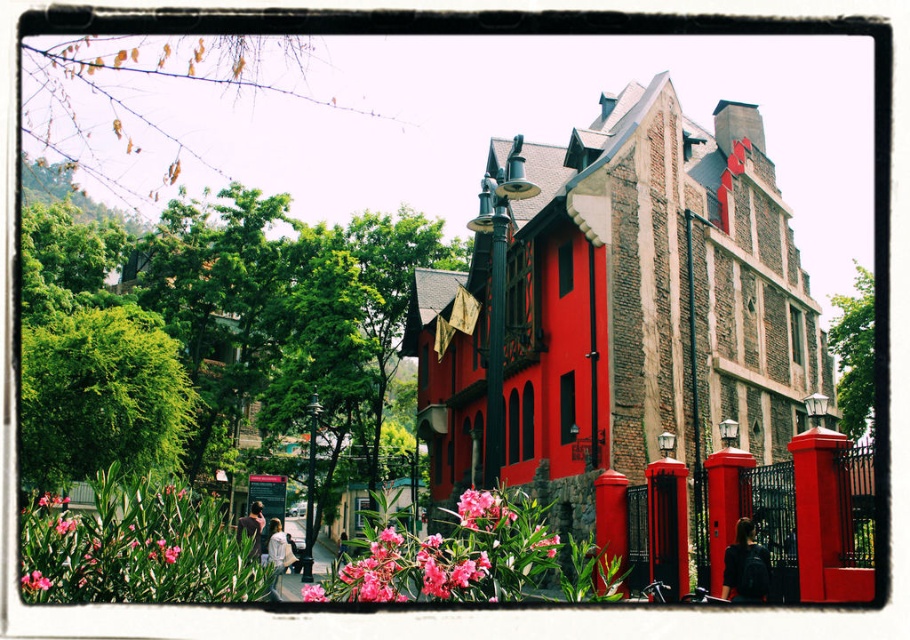
Which is more to the right, pink matte flower at lower left or pink matte flower at center?

pink matte flower at center

Does pink matte flower at lower left have a lesser width compared to pink matte flower at center?

Correct, pink matte flower at lower left's width is less than pink matte flower at center's.

Is point (49, 582) farther from viewer compared to point (308, 595)?

No, (49, 582) is in front of (308, 595).

Locate an element on the screen. This screenshot has height=640, width=910. pink matte flower at lower left is located at coordinates (35, 580).

Between point (312, 515) and point (44, 580), which one is positioned in front?

Point (44, 580) is in front.

Image resolution: width=910 pixels, height=640 pixels. What are the coordinates of `black metal lamp post at center` in the screenshot? It's located at (310, 492).

The height and width of the screenshot is (640, 910). In order to click on black metal lamp post at center in this screenshot , I will do `click(310, 492)`.

Find the location of `black metal lamp post at center`. black metal lamp post at center is located at coordinates (310, 492).

Does pink matte flower at lower center lie behind green matte lamp post at center?

No, pink matte flower at lower center is in front of green matte lamp post at center.

Is pink matte flower at lower center thinner than green matte lamp post at center?

In fact, pink matte flower at lower center might be wider than green matte lamp post at center.

Which is in front, point (406, 547) or point (509, 182)?

Positioned in front is point (406, 547).

This screenshot has width=910, height=640. Find the location of `pink matte flower at lower center`. pink matte flower at lower center is located at coordinates (453, 556).